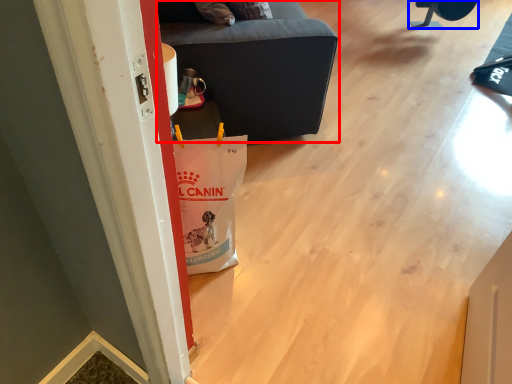
Question: Among these objects, which one is nearest to the camera, furniture (highlighted by a red box) or furniture (highlighted by a blue box)?

Choices:
 (A) furniture
 (B) furniture

Answer: (A)